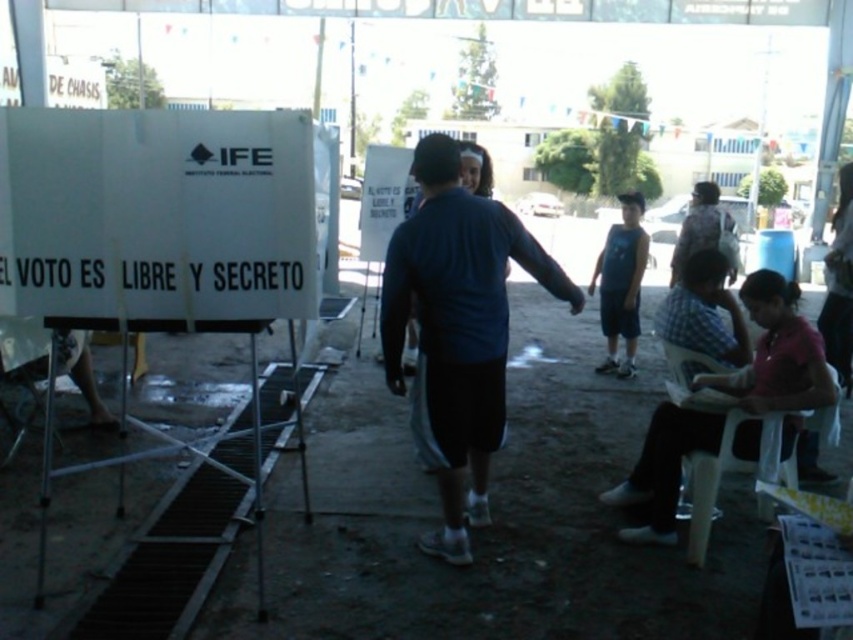
Question: Which of the following is the farthest from the observer?

Choices:
 (A) (490, 202)
 (B) (631, 336)
 (C) (676, 412)

Answer: (B)

Question: Can you confirm if dark blue fabric shirt at center is positioned to the right of blue cotton shirt at center?

Choices:
 (A) yes
 (B) no

Answer: (B)

Question: Which object appears closest to the camera in this image?

Choices:
 (A) dark blue fabric shirt at center
 (B) pink fabric shirt at lower right

Answer: (A)

Question: Is dark blue fabric shirt at center wider than blue cotton shirt at center?

Choices:
 (A) no
 (B) yes

Answer: (B)

Question: Can you confirm if dark blue fabric shirt at center is positioned below pink fabric shirt at lower right?

Choices:
 (A) no
 (B) yes

Answer: (A)

Question: Among these objects, which one is farthest from the camera?

Choices:
 (A) blue cotton shirt at center
 (B) dark blue fabric shirt at center
 (C) pink fabric shirt at lower right

Answer: (A)